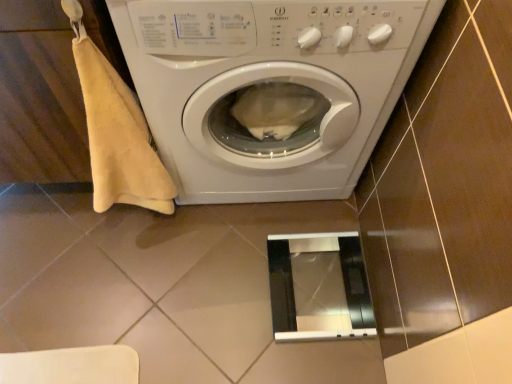
Question: Based on their positions, is white glossy washing machine at center located to the left or right of beige cotton towel at left?

Choices:
 (A) right
 (B) left

Answer: (A)

Question: Does point (174, 115) appear closer or farther from the camera than point (124, 150)?

Choices:
 (A) closer
 (B) farther

Answer: (A)

Question: Which is farther from the white glossy washing machine at center?

Choices:
 (A) metallic silver screen door at lower center
 (B) beige cotton towel at left

Answer: (A)

Question: Which is nearer to the beige cotton towel at left?

Choices:
 (A) metallic silver screen door at lower center
 (B) white glossy washing machine at center

Answer: (B)